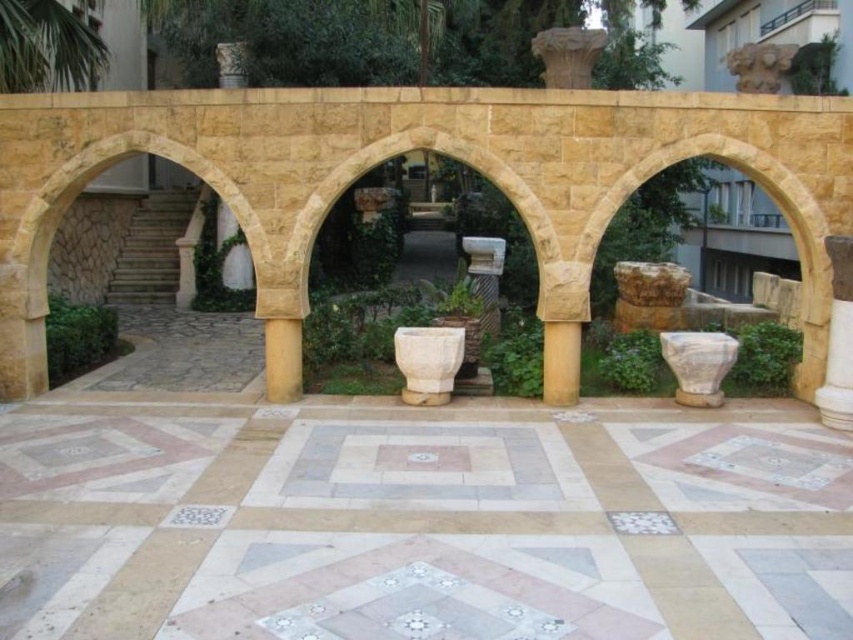
Question: Which point is farther from the camera taking this photo?

Choices:
 (A) (442, 342)
 (B) (233, 218)

Answer: (B)

Question: Is white stone urn at center positioned at the back of smooth stone column at center?

Choices:
 (A) no
 (B) yes

Answer: (A)

Question: Which point is farther to the camera?

Choices:
 (A) white stone urn at center
 (B) smooth stone column at center

Answer: (B)

Question: Can you confirm if white stone urn at center is positioned above smooth stone column at center?

Choices:
 (A) no
 (B) yes

Answer: (A)

Question: Is white stone urn at center thinner than smooth stone column at center?

Choices:
 (A) yes
 (B) no

Answer: (B)